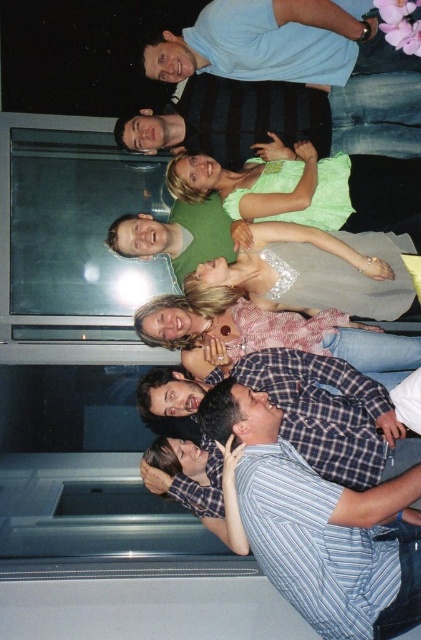
Question: Can you confirm if light blue shirt at upper center is positioned to the left of green satin blouse at upper center?

Choices:
 (A) yes
 (B) no

Answer: (B)

Question: Does striped cotton shirt at lower right appear on the right side of matte black shirt at upper center?

Choices:
 (A) yes
 (B) no

Answer: (A)

Question: Based on their relative distances, which object is nearer to the matte black shirt at upper center?

Choices:
 (A) striped cotton shirt at lower right
 (B) light blue shirt at upper center

Answer: (B)

Question: Estimate the real-world distances between objects in this image. Which object is closer to the light blue shirt at upper center?

Choices:
 (A) matte black shirt at upper center
 (B) striped cotton shirt at lower right
 (C) green satin blouse at upper center

Answer: (A)

Question: Observing the image, what is the correct spatial positioning of light blue shirt at upper center in reference to matte black shirt at upper center?

Choices:
 (A) left
 (B) right

Answer: (B)

Question: Considering the real-world distances, which object is farthest from the green satin blouse at upper center?

Choices:
 (A) light blue shirt at upper center
 (B) striped cotton shirt at lower right
 (C) matte black shirt at upper center

Answer: (B)